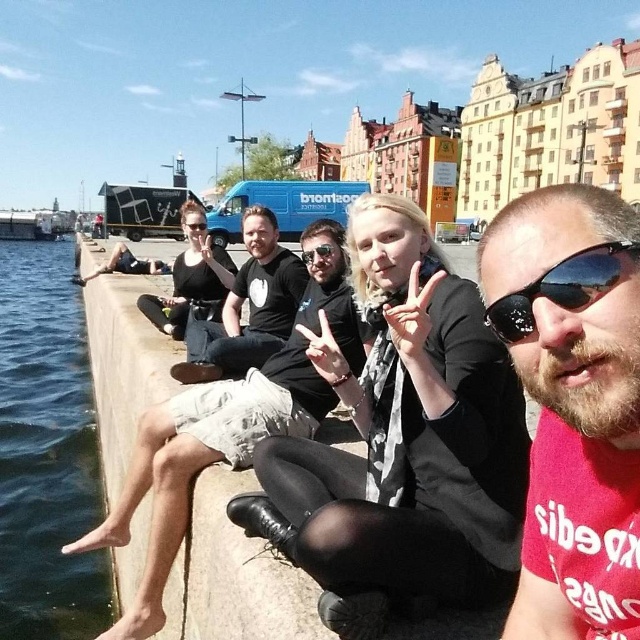
Question: Can you confirm if light beige shorts at center is positioned below matte black sunglasses at center?

Choices:
 (A) yes
 (B) no

Answer: (A)

Question: Which object appears closest to the camera in this image?

Choices:
 (A) black matte t-shirt at center
 (B) matte black sunglasses at center

Answer: (A)

Question: Which object is closer to the camera taking this photo?

Choices:
 (A) black matte t-shirt at center
 (B) light beige shorts at center
 (C) black reflective sunglasses at center

Answer: (C)

Question: Is light beige shorts at center further to the viewer compared to black plastic goggles at center?

Choices:
 (A) no
 (B) yes

Answer: (A)

Question: Which point appears closest to the camera in this image?

Choices:
 (A) (189, 225)
 (B) (49, 381)

Answer: (A)

Question: Considering the relative positions of black reflective sunglasses at center and matte black sunglasses at center in the image provided, where is black reflective sunglasses at center located with respect to matte black sunglasses at center?

Choices:
 (A) left
 (B) right

Answer: (B)